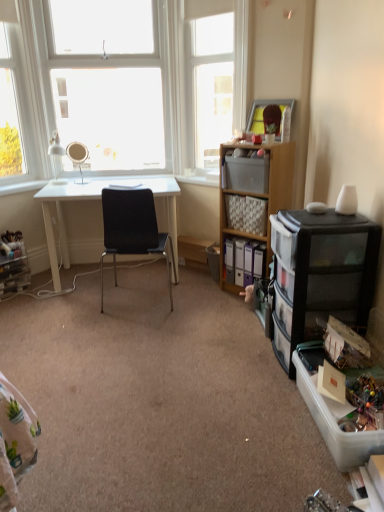
Locate an element on the screen. The width and height of the screenshot is (384, 512). free space to the left of wooden cabinet at center right, which appears as the second cabinetry when viewed from the front is located at coordinates (203, 295).